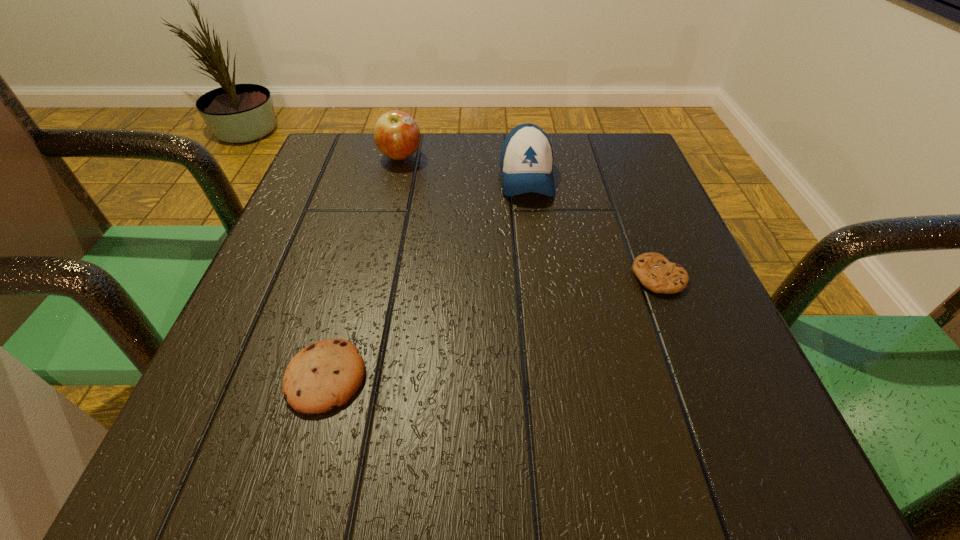
Where is `baseball cap that is positioned at the far edge`? The height and width of the screenshot is (540, 960). baseball cap that is positioned at the far edge is located at coordinates click(x=526, y=161).

At what (x,y) coordinates should I click in order to perform the action: click on apple present at the far edge. Please return your answer as a coordinate pair (x, y). The image size is (960, 540). Looking at the image, I should click on (397, 135).

This screenshot has width=960, height=540. I want to click on apple that is at the left edge, so click(397, 135).

Identify the location of cookie located in the left edge section of the desktop. This screenshot has width=960, height=540. (327, 373).

Find the location of a particular element. This screenshot has height=540, width=960. object situated at the right edge is located at coordinates (654, 271).

What are the coordinates of `object that is at the far left corner` in the screenshot? It's located at (397, 135).

The height and width of the screenshot is (540, 960). I want to click on free spot at the far edge of the desktop, so click(x=554, y=170).

In the image, there is a desktop. Identify the location of blank space at the near edge. The image size is (960, 540). (373, 454).

The height and width of the screenshot is (540, 960). In the image, there is a desktop. What are the coordinates of `vacant area at the left edge` in the screenshot? It's located at (371, 213).

In the image, there is a desktop. At what (x,y) coordinates should I click in order to perform the action: click on free space at the right edge. Please return your answer as a coordinate pair (x, y). This screenshot has width=960, height=540. Looking at the image, I should click on (708, 296).